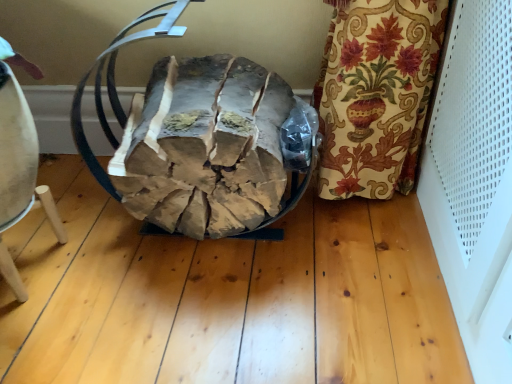
The width and height of the screenshot is (512, 384). What do you see at coordinates (50, 211) in the screenshot? I see `light brown wooden stool at lower left` at bounding box center [50, 211].

At what (x,y) coordinates should I click in order to perform the action: click on light brown wooden stool at lower left. Please return your answer as a coordinate pair (x, y). The image size is (512, 384). Looking at the image, I should click on (50, 211).

Measure the distance between point (251, 153) and camera.

33.94 inches.

This screenshot has width=512, height=384. What do you see at coordinates (181, 130) in the screenshot?
I see `brown leather bean bag chair at center` at bounding box center [181, 130].

This screenshot has width=512, height=384. I want to click on brown leather bean bag chair at center, so click(181, 130).

Find the location of a particular element. This screenshot has width=512, height=384. light brown wooden stool at lower left is located at coordinates (50, 211).

Looking at this image, considering the relative positions of brown leather bean bag chair at center and light brown wooden stool at lower left in the image provided, is brown leather bean bag chair at center to the right of light brown wooden stool at lower left from the viewer's perspective?

Yes, brown leather bean bag chair at center is to the right of light brown wooden stool at lower left.

Which object is closer to the camera taking this photo, brown leather bean bag chair at center or light brown wooden stool at lower left?

Positioned in front is brown leather bean bag chair at center.

Does point (303, 190) appear closer or farther from the camera than point (19, 285)?

Point (303, 190) appears to be farther away from the viewer than point (19, 285).

Looking at this image, from the image's perspective, between brown leather bean bag chair at center and light brown wooden stool at lower left, which one is located above?

brown leather bean bag chair at center is shown above in the image.

From a real-world perspective, which is physically below, brown leather bean bag chair at center or light brown wooden stool at lower left?

light brown wooden stool at lower left, from a real-world perspective.

Considering the sizes of brown leather bean bag chair at center and light brown wooden stool at lower left in the image, is brown leather bean bag chair at center wider or thinner than light brown wooden stool at lower left?

Clearly, brown leather bean bag chair at center has more width compared to light brown wooden stool at lower left.

Can you confirm if brown leather bean bag chair at center is shorter than light brown wooden stool at lower left?

In fact, brown leather bean bag chair at center may be taller than light brown wooden stool at lower left.

Which of these two, brown leather bean bag chair at center or light brown wooden stool at lower left, is smaller?

Smaller between the two is light brown wooden stool at lower left.

Is brown leather bean bag chair at center situated inside light brown wooden stool at lower left or outside?

brown leather bean bag chair at center is spatially situated outside light brown wooden stool at lower left.

Is there a large distance between brown leather bean bag chair at center and light brown wooden stool at lower left?

They are positioned close to each other.

Could you tell me if brown leather bean bag chair at center is turned towards light brown wooden stool at lower left?

No, brown leather bean bag chair at center does not turn towards light brown wooden stool at lower left.

What's the angular difference between brown leather bean bag chair at center and light brown wooden stool at lower left's facing directions?

1.49 degrees separate the facing orientations of brown leather bean bag chair at center and light brown wooden stool at lower left.

What are the coordinates of `bean bag chair above the light brown wooden stool at lower left (from the image's perspective)` in the screenshot? It's located at (181, 130).

Which object is positioned more to the left, light brown wooden stool at lower left or brown leather bean bag chair at center?

light brown wooden stool at lower left.

Consider the image. Is the position of light brown wooden stool at lower left more distant than that of brown leather bean bag chair at center?

Yes, it is behind brown leather bean bag chair at center.

Is point (11, 285) positioned behind point (254, 201)?

No, it is not.

From the image's perspective, is light brown wooden stool at lower left located above or below brown leather bean bag chair at center?

From the image's perspective, light brown wooden stool at lower left appears below brown leather bean bag chair at center.

From a real-world perspective, is light brown wooden stool at lower left physically located above or below brown leather bean bag chair at center?

Clearly, from a real-world perspective, light brown wooden stool at lower left is below brown leather bean bag chair at center.

Is light brown wooden stool at lower left wider or thinner than brown leather bean bag chair at center?

In the image, light brown wooden stool at lower left appears to be more narrow than brown leather bean bag chair at center.

Is light brown wooden stool at lower left taller or shorter than brown leather bean bag chair at center?

light brown wooden stool at lower left is shorter than brown leather bean bag chair at center.

In terms of size, does light brown wooden stool at lower left appear bigger or smaller than brown leather bean bag chair at center?

Clearly, light brown wooden stool at lower left is smaller in size than brown leather bean bag chair at center.

Would you say light brown wooden stool at lower left is outside brown leather bean bag chair at center?

Yes, light brown wooden stool at lower left is located beyond the bounds of brown leather bean bag chair at center.

Is light brown wooden stool at lower left not near brown leather bean bag chair at center?

No, light brown wooden stool at lower left is not far away from brown leather bean bag chair at center.

Is light brown wooden stool at lower left facing away from brown leather bean bag chair at center?

No.

How different are the orientations of light brown wooden stool at lower left and brown leather bean bag chair at center in degrees?

There is a 1.49-degree angle between the facing directions of light brown wooden stool at lower left and brown leather bean bag chair at center.

From the picture: How far apart are light brown wooden stool at lower left and brown leather bean bag chair at center?

13.88 inches.

Locate an element on the screen. The width and height of the screenshot is (512, 384). bean bag chair to the right of light brown wooden stool at lower left is located at coordinates (181, 130).

In order to click on bean bag chair above the light brown wooden stool at lower left (from a real-world perspective) in this screenshot , I will do `click(181, 130)`.

This screenshot has height=384, width=512. In order to click on furniture that is under the brown leather bean bag chair at center (from a real-world perspective) in this screenshot , I will do `click(50, 211)`.